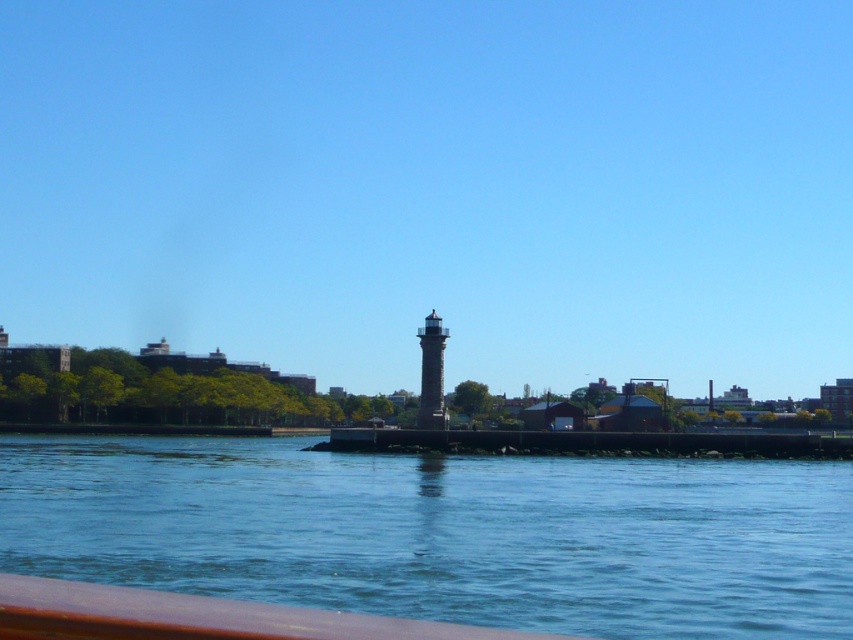
Between blue water at center and gray stone lighthouse at center, which one appears on the right side from the viewer's perspective?

gray stone lighthouse at center is more to the right.

Who is higher up, blue water at center or gray stone lighthouse at center?

Positioned higher is gray stone lighthouse at center.

Which is in front, point (221, 582) or point (440, 372)?

Point (221, 582) is in front.

The image size is (853, 640). I want to click on blue water at center, so click(444, 532).